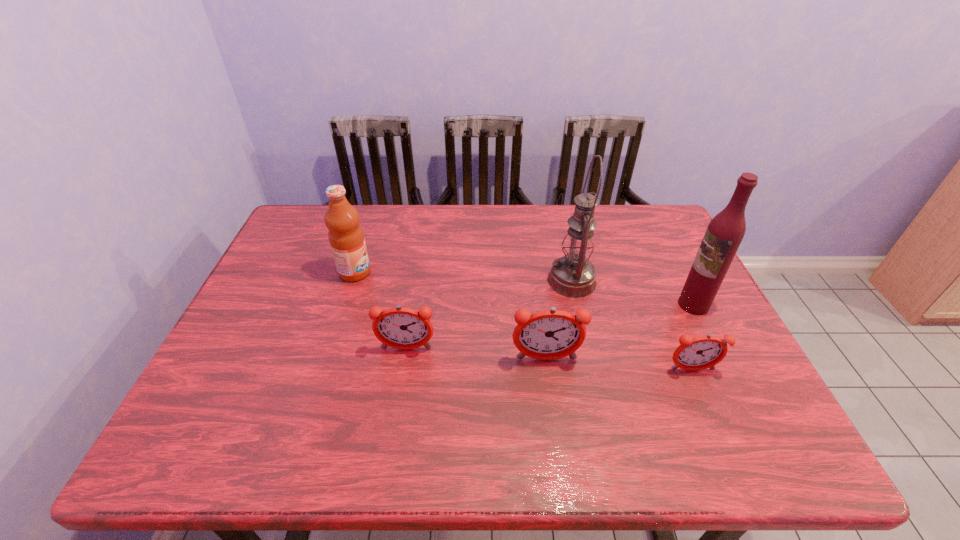
Image resolution: width=960 pixels, height=540 pixels. Find the location of `vacant area at the near edge`. vacant area at the near edge is located at coordinates (635, 396).

This screenshot has width=960, height=540. In the image, there is a desktop. Identify the location of vacant space at the left edge. (256, 359).

In the image, there is a desktop. Identify the location of vacant region at the right edge. This screenshot has height=540, width=960. (631, 250).

The height and width of the screenshot is (540, 960). I want to click on free space at the far right corner of the desktop, so click(x=631, y=236).

Where is `unoccupied area between the liquor and the second alarm clock from left to right`? The height and width of the screenshot is (540, 960). unoccupied area between the liquor and the second alarm clock from left to right is located at coordinates (620, 332).

Find the location of a particular element. free spot between the fruit juice and the oil lamp is located at coordinates (464, 276).

Find the location of a particular element. vacant area between the liquor and the second alarm clock from right to left is located at coordinates (620, 332).

Find the location of a particular element. This screenshot has width=960, height=540. empty space that is in between the liquor and the oil lamp is located at coordinates (633, 293).

This screenshot has height=540, width=960. Identify the location of vacant space that is in between the oil lamp and the third tallest object. (464, 276).

Find the location of `free space between the second alarm clock from right to left and the shortest alarm clock`. free space between the second alarm clock from right to left and the shortest alarm clock is located at coordinates (619, 364).